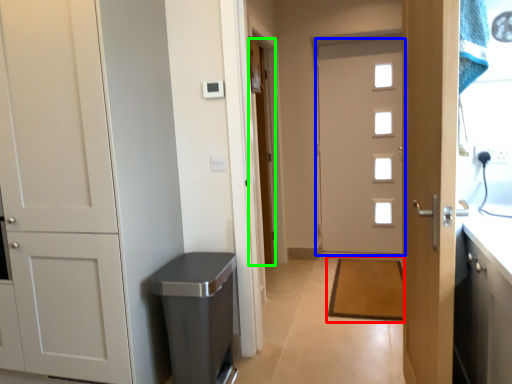
Question: Considering the real-world distances, which object is closest to doormat (highlighted by a red box)? door (highlighted by a blue box) or door (highlighted by a green box).

Choices:
 (A) door
 (B) door

Answer: (A)